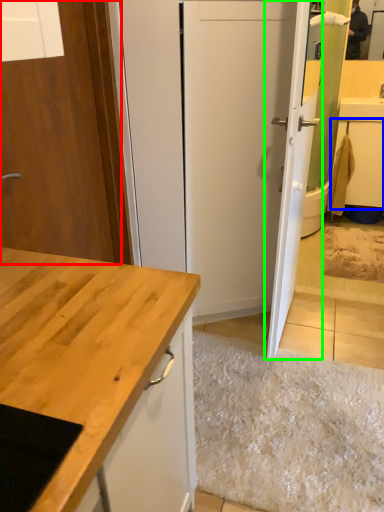
Question: Considering the real-world distances, which object is closest to door (highlighted by a red box)? cabinetry (highlighted by a blue box) or door (highlighted by a green box).

Choices:
 (A) cabinetry
 (B) door

Answer: (B)